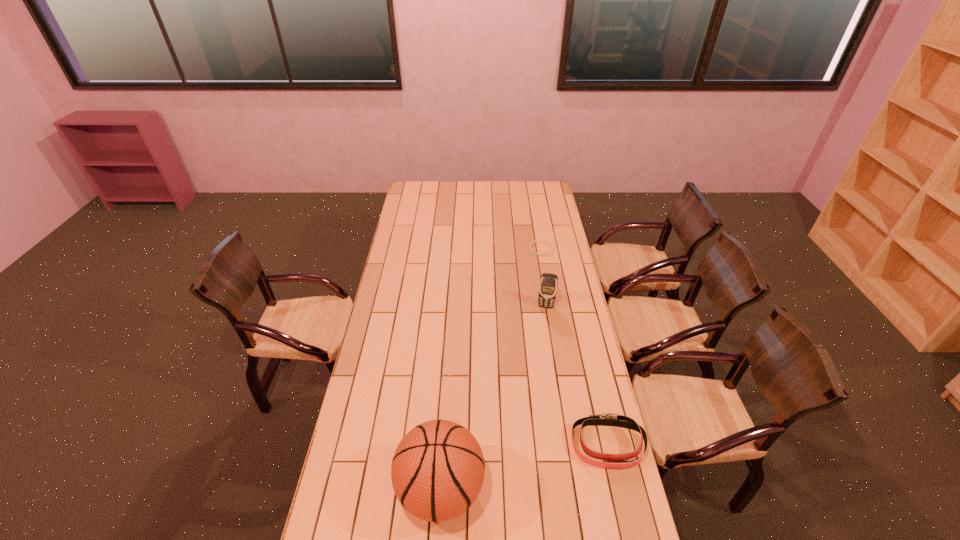
The height and width of the screenshot is (540, 960). Identify the location of free space on the desktop that is between the basketball and the dog collar and is positioned on the surface of the bracelet showing star-shaped elements. (525, 467).

At what (x,y) coordinates should I click in order to perform the action: click on free spot on the desktop that is between the basketball and the dog collar and is positioned on the front face of the third nearest object. Please return your answer as a coordinate pair (x, y). The image size is (960, 540). Looking at the image, I should click on (518, 469).